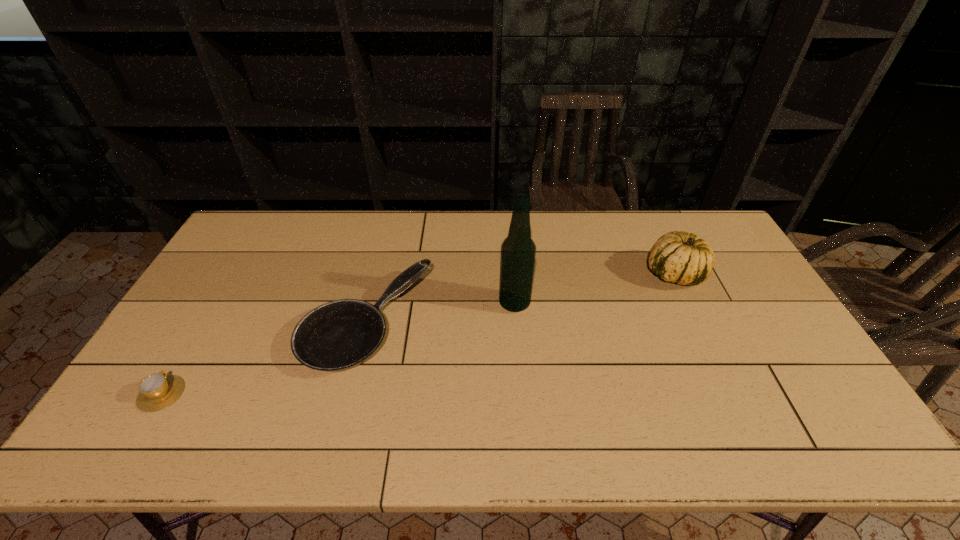
Locate an element on the screen. The image size is (960, 540). vacant space at the near left corner of the desktop is located at coordinates (156, 438).

At what (x,y) coordinates should I click in order to perform the action: click on empty space between the third object from left to right and the frying pan. Please return your answer as a coordinate pair (x, y). The image size is (960, 540). Looking at the image, I should click on (441, 313).

Locate an element on the screen. This screenshot has width=960, height=540. free space between the second object from left to right and the alcohol is located at coordinates (441, 313).

What are the coordinates of `free spot between the cup and the gourd` in the screenshot? It's located at [x=418, y=334].

Identify the location of vacant space that's between the leftmost object and the rightmost object. Image resolution: width=960 pixels, height=540 pixels. (418, 334).

The height and width of the screenshot is (540, 960). In order to click on free area in between the third shortest object and the tallest object in this screenshot , I will do `click(594, 288)`.

Where is `empty space that is in between the leftmost object and the second object from left to right`? Image resolution: width=960 pixels, height=540 pixels. empty space that is in between the leftmost object and the second object from left to right is located at coordinates (264, 358).

This screenshot has width=960, height=540. What are the coordinates of `unoccupied area between the alcohol and the frying pan` in the screenshot? It's located at (441, 313).

Image resolution: width=960 pixels, height=540 pixels. I want to click on the closest object to the third shortest object, so click(x=518, y=251).

Locate which object is the third closest to the rightmost object. Please provide its 2D coordinates. Your answer should be formatted as a tuple, i.e. [(x, y)], where the tuple contains the x and y coordinates of a point satisfying the conditions above.

[(157, 391)]